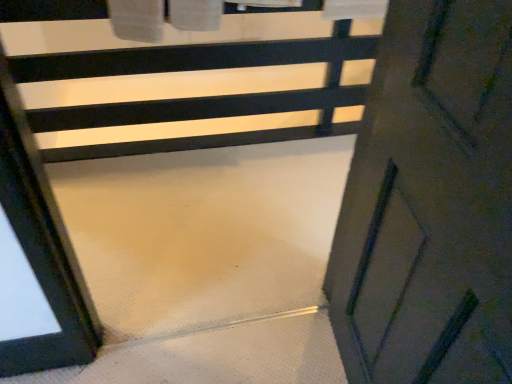
The image size is (512, 384). What do you see at coordinates (195, 97) in the screenshot? I see `white matte stair at center` at bounding box center [195, 97].

The height and width of the screenshot is (384, 512). Identify the location of white matte stair at center. (195, 97).

The image size is (512, 384). Describe the element at coordinates (430, 203) in the screenshot. I see `matte white door at lower right` at that location.

This screenshot has width=512, height=384. In order to click on matte white door at lower right in this screenshot , I will do `click(430, 203)`.

Find the location of `white matte stair at center`. white matte stair at center is located at coordinates (195, 97).

Which object is positioned more to the right, white matte stair at center or matte white door at lower right?

matte white door at lower right is more to the right.

Is the depth of white matte stair at center greater than that of matte white door at lower right?

Yes, white matte stair at center is further from the viewer.

Considering the positions of point (234, 56) and point (412, 341), is point (234, 56) closer or farther from the camera than point (412, 341)?

Point (234, 56) is farther from the camera than point (412, 341).

From the image's perspective, who appears lower, white matte stair at center or matte white door at lower right?

matte white door at lower right is shown below in the image.

From a real-world perspective, which is physically above, white matte stair at center or matte white door at lower right?

matte white door at lower right, from a real-world perspective.

Looking at their sizes, would you say white matte stair at center is wider or thinner than matte white door at lower right?

Clearly, white matte stair at center has more width compared to matte white door at lower right.

Does white matte stair at center have a lesser height compared to matte white door at lower right?

Correct, white matte stair at center is not as tall as matte white door at lower right.

Can you confirm if white matte stair at center is bigger than matte white door at lower right?

Yes.

Is matte white door at lower right inside white matte stair at center?

No, matte white door at lower right is not surrounded by white matte stair at center.

Is white matte stair at center positioned far away from matte white door at lower right?

Indeed, white matte stair at center is not near matte white door at lower right.

Is white matte stair at center oriented away from matte white door at lower right?

white matte stair at center does not have its back to matte white door at lower right.

How many degrees apart are the facing directions of white matte stair at center and matte white door at lower right?

They differ by 94.6 degrees in their facing directions.

I want to click on stair that is under the matte white door at lower right (from a real-world perspective), so click(195, 97).

From the picture: Is matte white door at lower right at the right side of white matte stair at center?

Yes.

Which object is more forward, matte white door at lower right or white matte stair at center?

Positioned in front is matte white door at lower right.

Which point is more forward, (439, 26) or (227, 42)?

The point (439, 26) is in front.

From the image's perspective, who appears lower, matte white door at lower right or white matte stair at center?

matte white door at lower right appears lower in the image.

From a real-world perspective, relative to white matte stair at center, is matte white door at lower right vertically above or below?

In terms of real-world spatial position, matte white door at lower right is above white matte stair at center.

Which of these two, matte white door at lower right or white matte stair at center, is wider?

white matte stair at center is wider.

Is matte white door at lower right shorter than white matte stair at center?

Incorrect, the height of matte white door at lower right does not fall short of that of white matte stair at center.

Based on the photo, which of these two, matte white door at lower right or white matte stair at center, is bigger?

white matte stair at center is bigger.

Is matte white door at lower right positioned beyond the bounds of white matte stair at center?

Absolutely, matte white door at lower right is external to white matte stair at center.

Are matte white door at lower right and white matte stair at center far apart?

Indeed, matte white door at lower right is not near white matte stair at center.

Is matte white door at lower right aimed at white matte stair at center?

Yes.

How many degrees apart are the facing directions of matte white door at lower right and white matte stair at center?

They differ by 94.6 degrees in their facing directions.

Image resolution: width=512 pixels, height=384 pixels. In the image, there is a white matte stair at center. In order to click on door below it (from the image's perspective) in this screenshot , I will do coord(430,203).

You are a GUI agent. You are given a task and a screenshot of the screen. Output one action in this format:
    pyautogui.click(x=<x>, y=<y>)
    Task: Click on the stair lying on the left of matte white door at lower right
    This screenshot has width=512, height=384.
    Given the screenshot: What is the action you would take?
    pyautogui.click(x=195, y=97)

The height and width of the screenshot is (384, 512). In order to click on door on the right of the white matte stair at center in this screenshot , I will do `click(430, 203)`.